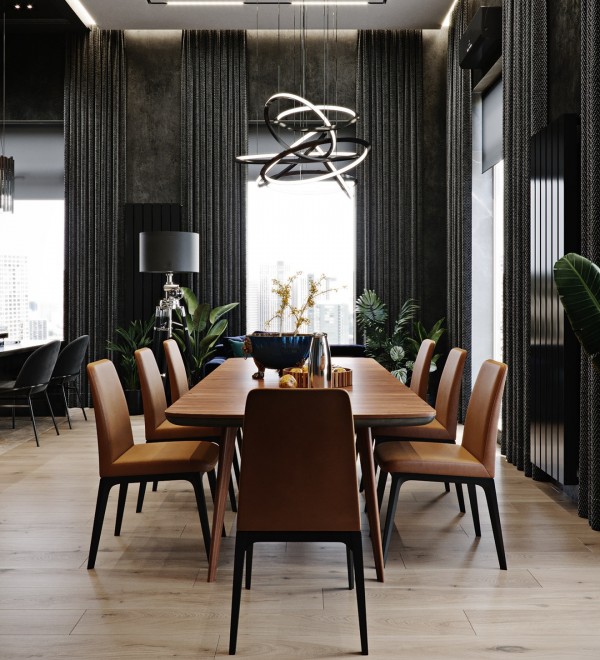
Find the location of `windows`. windows is located at coordinates (281, 261), (51, 249).